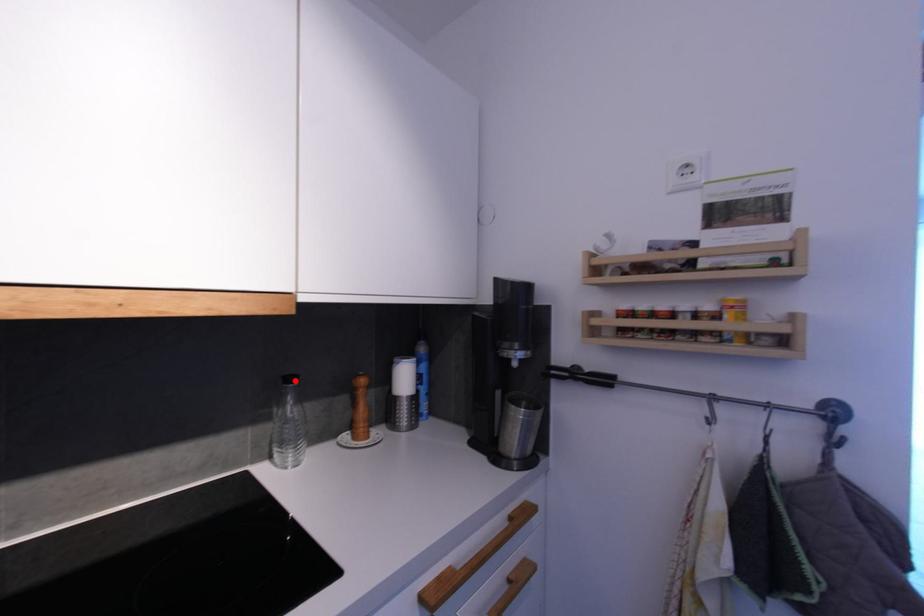
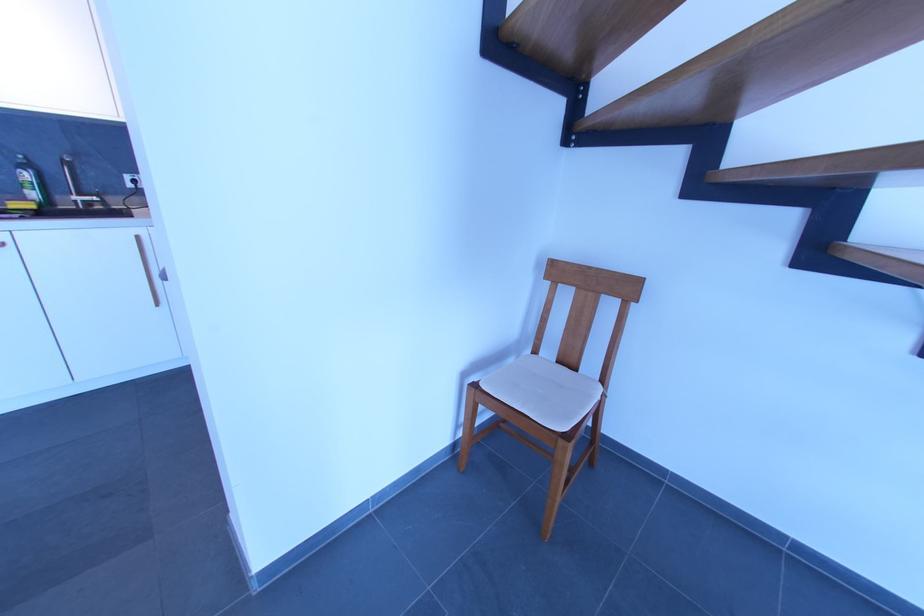
Question: I am providing you with two images of the same scene from different viewpoints. A red point is marked on the first image. Is the red point's position out of view in image 2?

Choices:
 (A) Yes
 (B) No

Answer: (A)